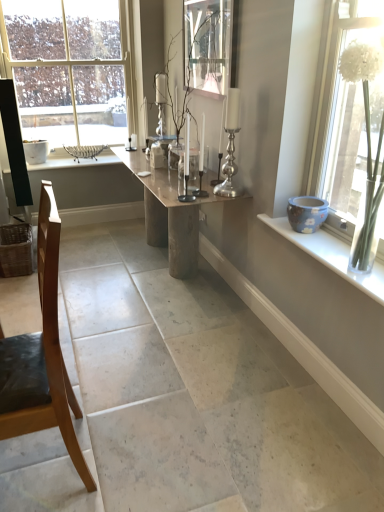
Question: Considering the positions of clear glass window at upper left, which is counted as the 1th window, starting from the left, and blue ceramic pot at right in the image, is clear glass window at upper left, which is counted as the 1th window, starting from the left, wider or thinner than blue ceramic pot at right?

Choices:
 (A) thin
 (B) wide

Answer: (A)

Question: Does point (34, 89) appear closer or farther from the camera than point (364, 285)?

Choices:
 (A) closer
 (B) farther

Answer: (B)

Question: Which is nearer to the light wood chair at left?

Choices:
 (A) clear glass candle holder at center, the second candle holder viewed from the right
 (B) natural wood table at center
 (C) silver metallic candle holder at center, the 2th candle holder viewed from the left
 (D) clear glass window at upper left, marked as the first window in a top-to-bottom arrangement
 (E) blue ceramic pot at right

Answer: (B)

Question: Considering the real-world distances, which object is closest to the light wood chair at left?

Choices:
 (A) blue ceramic pot at right
 (B) clear glass window at upper left, which is counted as the 1th window, starting from the left
 (C) silver metallic candle holder at center, the 2th candle holder viewed from the left
 (D) clear glass picture frame at upper center
 (E) clear glass candle holder at center, which ranks as the 1th candle holder in left-to-right order

Answer: (A)